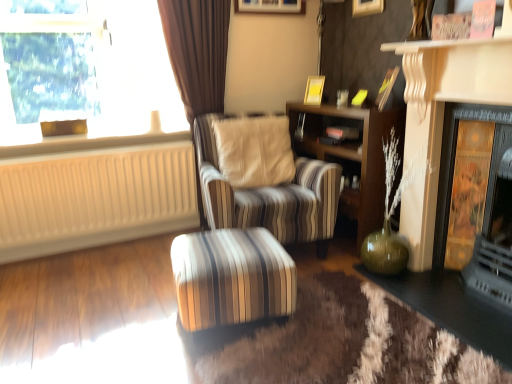
Identify the location of vacant position to the left of green glass vase at lower right, which ranks as the first table in right-to-left order. The height and width of the screenshot is (384, 512). (343, 317).